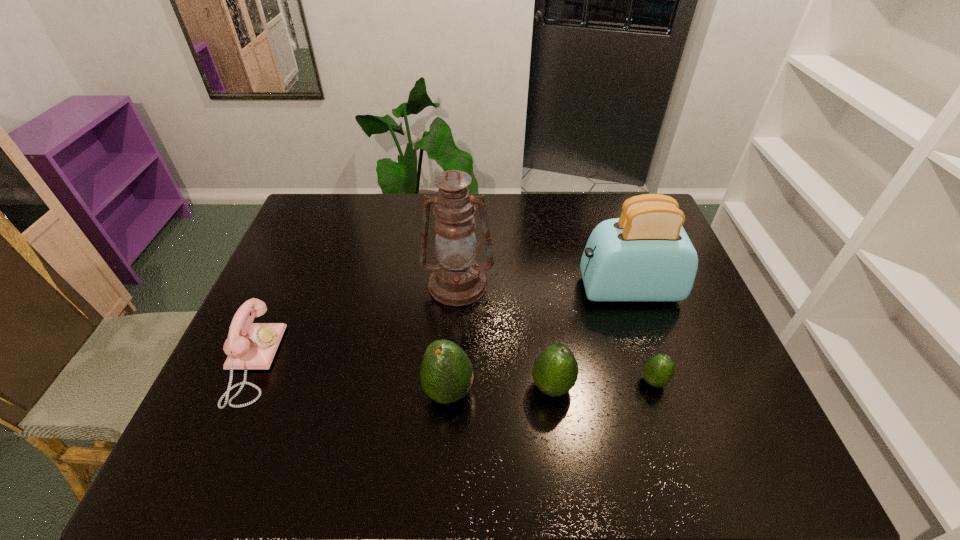
With all avocados evenly spaced, where should an extra avocado be placed on the left to continue the pattern? Please point out a vacant space. Please provide its 2D coordinates. Your answer should be formatted as a tuple, i.e. [(x, y)], where the tuple contains the x and y coordinates of a point satisfying the conditions above.

[(343, 398)]